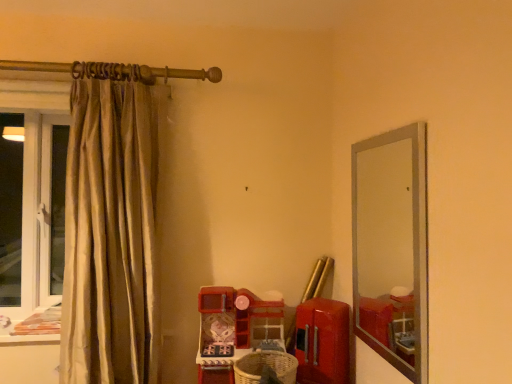
Looking at this image, what is the approximate height of silky beige curtain at left?

The height of silky beige curtain at left is 4.30 feet.

In order to face woven brown basket at lower center, should I rotate leftwards or rightwards?

You should look right and rotate roughly 1.146 degrees.

The image size is (512, 384). What are the coordinates of `silky beige curtain at left` in the screenshot? It's located at (110, 228).

Is woven brown basket at lower center further to the viewer compared to clear glass mirror at right?

Yes, it is.

In the scene shown: Is woven brown basket at lower center positioned with its back to clear glass mirror at right?

No.

Is woven brown basket at lower center bigger than clear glass mirror at right?

No, woven brown basket at lower center is not bigger than clear glass mirror at right.

Is woven brown basket at lower center with clear glass mirror at right?

No, woven brown basket at lower center is not touching clear glass mirror at right.

Between silky beige curtain at left and clear glass mirror at right, which one has larger width?

With larger width is silky beige curtain at left.

Is silky beige curtain at left to the left of clear glass mirror at right from the viewer's perspective?

Yes, silky beige curtain at left is to the left of clear glass mirror at right.

Considering the positions of objects silky beige curtain at left and clear glass mirror at right in the image provided, who is behind, silky beige curtain at left or clear glass mirror at right?

silky beige curtain at left.

How different are the orientations of silky beige curtain at left and clear glass mirror at right in degrees?

The facing directions of silky beige curtain at left and clear glass mirror at right are 90.2 degrees apart.

Could you tell me if silky beige curtain at left is facing woven brown basket at lower center?

No, silky beige curtain at left is not oriented towards woven brown basket at lower center.

Considering the relative sizes of silky beige curtain at left and woven brown basket at lower center in the image provided, is silky beige curtain at left shorter than woven brown basket at lower center?

Incorrect, the height of silky beige curtain at left does not fall short of that of woven brown basket at lower center.

Considering their positions, is silky beige curtain at left located in front of or behind woven brown basket at lower center?

Visually, silky beige curtain at left is located in front of woven brown basket at lower center.

From the image's perspective, relative to woven brown basket at lower center, is silky beige curtain at left above or below?

silky beige curtain at left is above woven brown basket at lower center.

Is woven brown basket at lower center shorter than silky beige curtain at left?

Yes.

From the image's perspective, is woven brown basket at lower center over silky beige curtain at left?

No, from the image's perspective, woven brown basket at lower center is not on top of silky beige curtain at left.

How different are the orientations of woven brown basket at lower center and silky beige curtain at left in degrees?

The angle between the facing direction of woven brown basket at lower center and the facing direction of silky beige curtain at left is 92.7 degrees.

From a real-world perspective, is woven brown basket at lower center positioned under silky beige curtain at left based on gravity?

Yes, from a real-world perspective, woven brown basket at lower center is beneath silky beige curtain at left.

Which is correct: clear glass mirror at right is inside woven brown basket at lower center, or outside of it?

The correct answer is: outside.

Is clear glass mirror at right with woven brown basket at lower center?

No, clear glass mirror at right is not making contact with woven brown basket at lower center.

Is clear glass mirror at right behind woven brown basket at lower center?

No, the depth of clear glass mirror at right is less than that of woven brown basket at lower center.

Based on the photo, from a real-world perspective, who is located lower, clear glass mirror at right or woven brown basket at lower center?

From a 3D spatial view, woven brown basket at lower center is below.

Is clear glass mirror at right beside silky beige curtain at left?

clear glass mirror at right and silky beige curtain at left are clearly separated.

Which point is more distant from viewer, [366,210] or [135,271]?

The point [366,210] is farther.

Could you tell me if clear glass mirror at right is facing silky beige curtain at left?

Yes.

In the image, there is a silky beige curtain at left. Where is `mirror below it (from a real-world perspective)`? Image resolution: width=512 pixels, height=384 pixels. mirror below it (from a real-world perspective) is located at coordinates (385, 246).

In the image, there is a clear glass mirror at right. Where is `basket below it (from the image's perspective)`? This screenshot has height=384, width=512. basket below it (from the image's perspective) is located at coordinates (265, 365).

Identify the location of curtain located above the clear glass mirror at right (from the image's perspective). The height and width of the screenshot is (384, 512). (110, 228).

Which object lies nearer to the anchor point silky beige curtain at left, woven brown basket at lower center or clear glass mirror at right?

The object closer to silky beige curtain at left is woven brown basket at lower center.

Estimate the real-world distances between objects in this image. Which object is further from clear glass mirror at right, silky beige curtain at left or woven brown basket at lower center?

silky beige curtain at left is further to clear glass mirror at right.

Estimate the real-world distances between objects in this image. Which object is further from silky beige curtain at left, clear glass mirror at right or woven brown basket at lower center?

The object further to silky beige curtain at left is clear glass mirror at right.

From the image, which object appears to be farther from woven brown basket at lower center, silky beige curtain at left or clear glass mirror at right?

silky beige curtain at left is further to woven brown basket at lower center.

Looking at the image, which one is located further to clear glass mirror at right, woven brown basket at lower center or silky beige curtain at left?

silky beige curtain at left.

Which object lies nearer to the anchor point woven brown basket at lower center, clear glass mirror at right or silky beige curtain at left?

clear glass mirror at right.

At what (x,y) coordinates should I click in order to perform the action: click on basket located between silky beige curtain at left and clear glass mirror at right in the left-right direction. Please return your answer as a coordinate pair (x, y). Image resolution: width=512 pixels, height=384 pixels. Looking at the image, I should click on (265, 365).